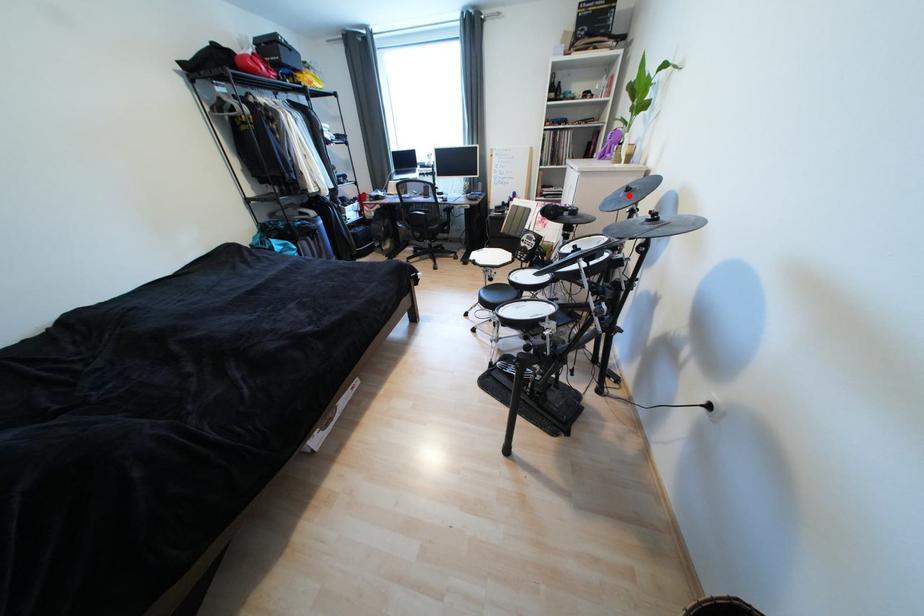
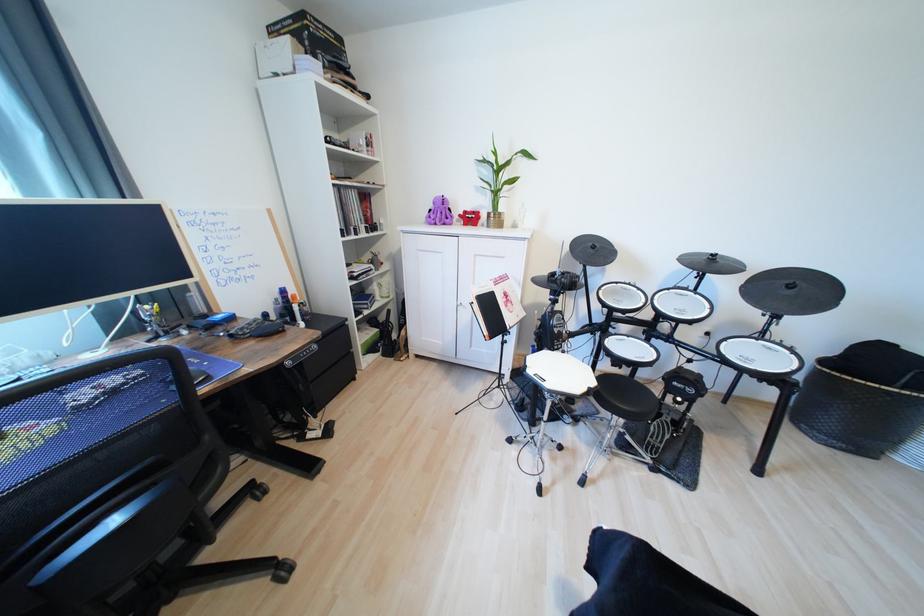
Locate, in the second image, the point that corresponds to the highlighted location in the first image.

(599, 252)